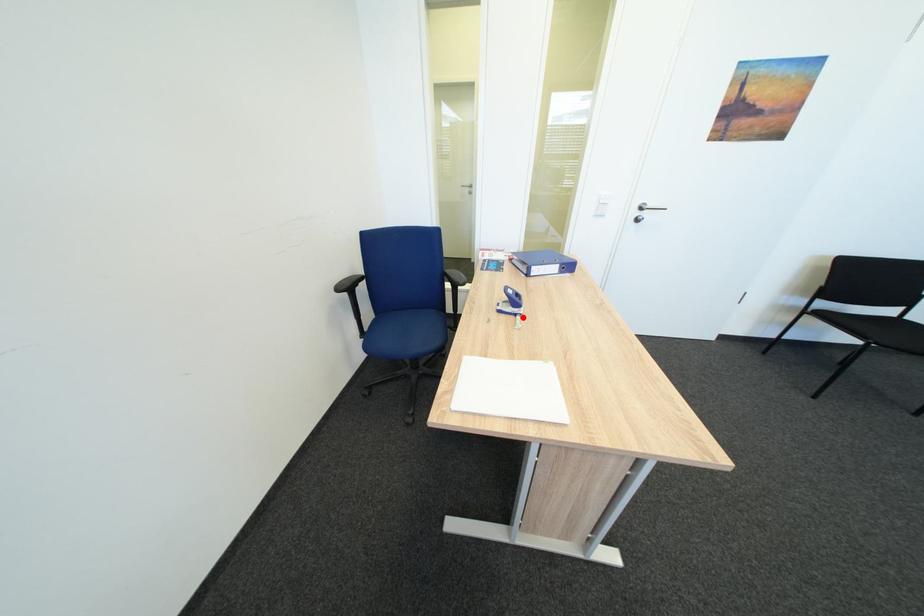
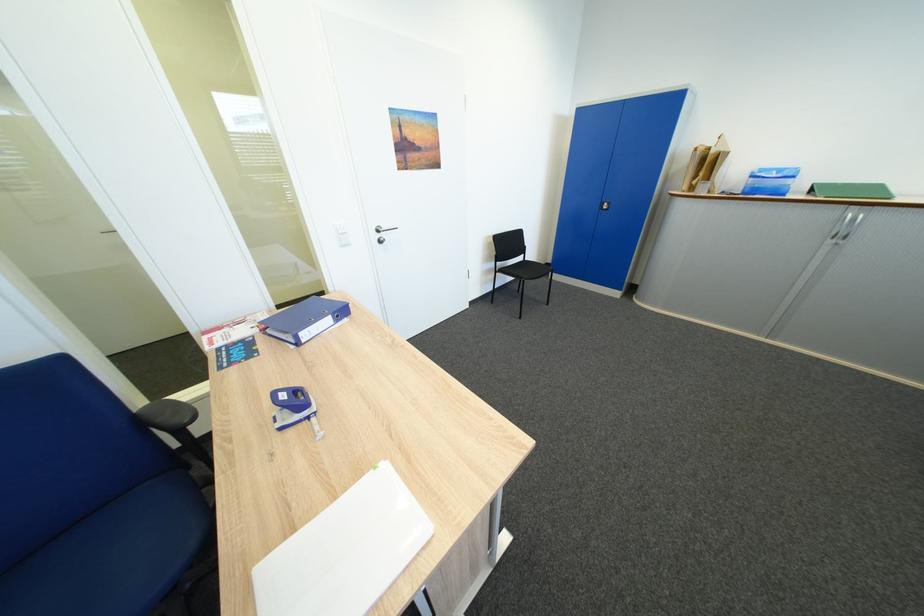
Question: I am providing you with two images of the same scene from different viewpoints. A red point is marked on the first image. Is the red point's position out of view in image 2?

Choices:
 (A) Yes
 (B) No

Answer: (B)